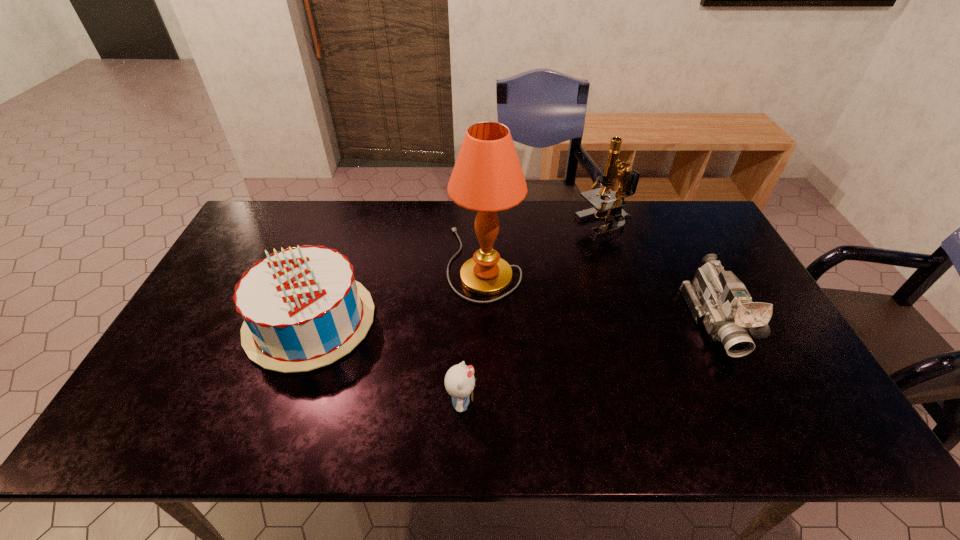
You are a GUI agent. You are given a task and a screenshot of the screen. Output one action in this format:
    pyautogui.click(x=<x>, y=<y>)
    Task: Click on the vacant point at the near edge
    The width and height of the screenshot is (960, 540).
    Given the screenshot: What is the action you would take?
    pyautogui.click(x=378, y=415)

Locate an element on the screen. The width and height of the screenshot is (960, 540). free space at the left edge of the desktop is located at coordinates (218, 269).

The image size is (960, 540). I want to click on vacant space at the right edge of the desktop, so [689, 246].

Where is `vacant space at the near right corner of the desktop`? vacant space at the near right corner of the desktop is located at coordinates (789, 418).

You are a GUI agent. You are given a task and a screenshot of the screen. Output one action in this format:
    pyautogui.click(x=<x>, y=<y>)
    Task: Click on the free space between the tallest object and the leftmost object
    The height and width of the screenshot is (540, 960).
    Given the screenshot: What is the action you would take?
    point(397,292)

I want to click on empty space between the microscope and the leftmost object, so click(x=458, y=272).

At what (x,y) coordinates should I click in order to perform the action: click on free space between the lamp and the nearest object. Please return your answer as a coordinate pair (x, y). Looking at the image, I should click on (473, 333).

This screenshot has height=540, width=960. In order to click on unoccupied position between the rightmost object and the tallest object in this screenshot , I will do `click(599, 292)`.

This screenshot has height=540, width=960. I want to click on vacant space in between the camcorder and the leftmost object, so click(x=513, y=321).

The image size is (960, 540). What are the coordinates of `free area in between the microscope and the lamp` in the screenshot? It's located at (545, 244).